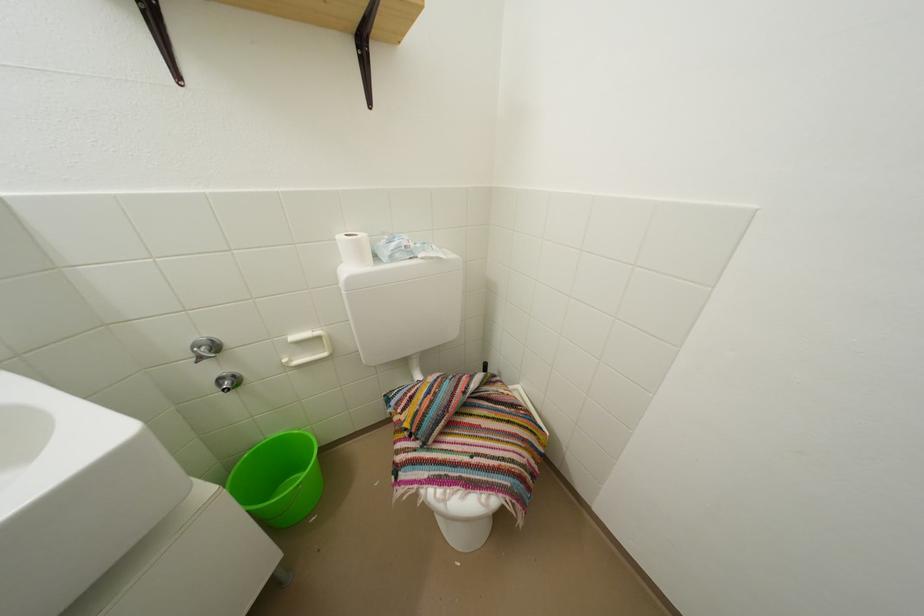
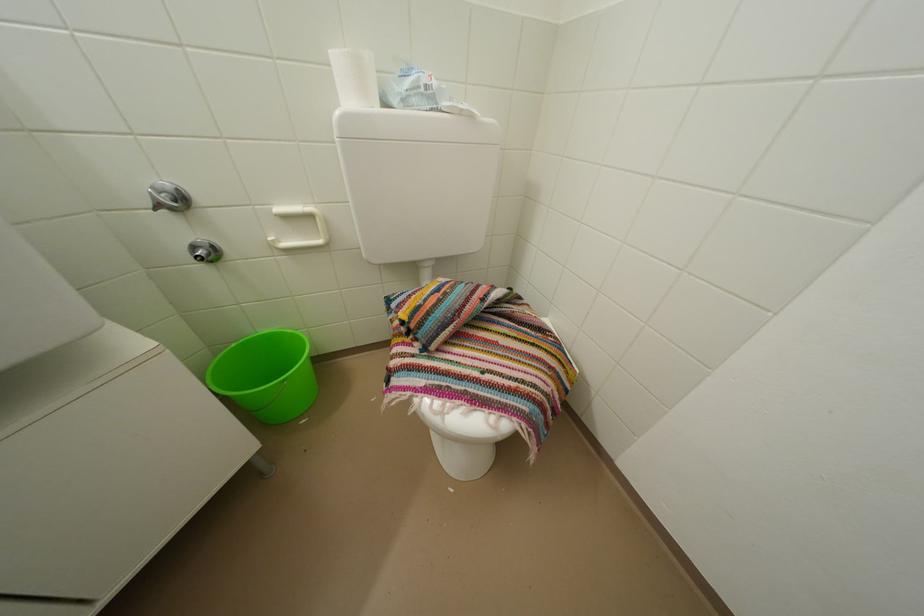
Question: What movement of the cameraman would produce the second image?

Choices:
 (A) Left
 (B) Right
 (C) Forward
 (D) Backward

Answer: (C)